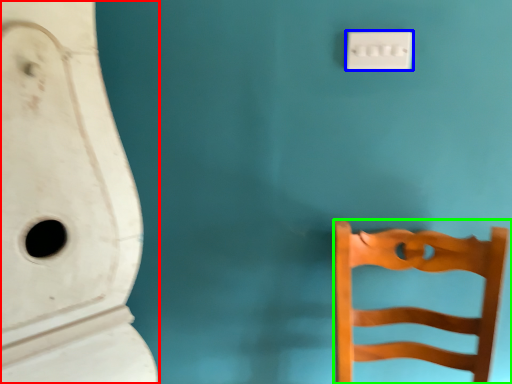
Question: Which is nearer to the urinal (highlighted by a red box)? light switch (highlighted by a blue box) or furniture (highlighted by a green box).

Choices:
 (A) light switch
 (B) furniture

Answer: (B)